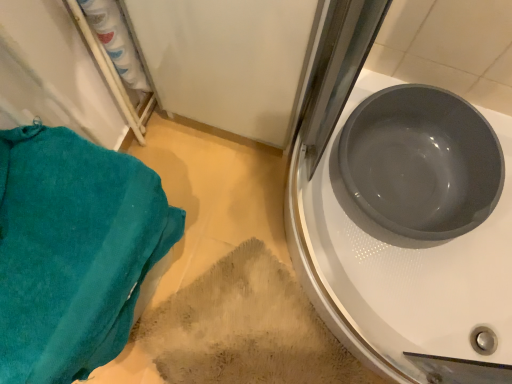
Where is `beige textured rug at lower center`? beige textured rug at lower center is located at coordinates (245, 328).

I want to click on matte gray basin at right, so click(421, 162).

Would you say teal terry cloth towel at lower left is inside or outside matte gray basin at upper right?

The correct answer is: outside.

From a real-world perspective, is teal terry cloth towel at lower left on matte gray basin at upper right?

Yes, from a real-world perspective, teal terry cloth towel at lower left is above matte gray basin at upper right.

Consider the image. What's the angular difference between teal terry cloth towel at lower left and matte gray basin at upper right's facing directions?

There is a 91-degree angle between the facing directions of teal terry cloth towel at lower left and matte gray basin at upper right.

Is teal terry cloth towel at lower left positioned with its back to matte gray basin at upper right?

That's not correct — teal terry cloth towel at lower left is not looking away from matte gray basin at upper right.

From a real-world perspective, between beige textured rug at lower center and matte gray basin at right, who is vertically higher?

matte gray basin at right is physically above.

The height and width of the screenshot is (384, 512). Find the location of `dirt below the matte gray basin at right (from the image's perspective)`. dirt below the matte gray basin at right (from the image's perspective) is located at coordinates tap(245, 328).

Can you confirm if beige textured rug at lower center is positioned to the left of matte gray basin at right?

Yes.

Which is behind, point (362, 378) or point (432, 90)?

The point (362, 378) is farther from the camera.

Based on their sizes in the image, would you say matte gray basin at upper right is bigger or smaller than teal terry cloth towel at lower left?

Considering their sizes, matte gray basin at upper right takes up more space than teal terry cloth towel at lower left.

You are a GUI agent. You are given a task and a screenshot of the screen. Output one action in this format:
    pyautogui.click(x=<x>, y=<y>)
    Task: Click on the sink that appears above the teal terry cloth towel at lower left (from the image's perspective)
    This screenshot has height=384, width=512.
    Given the screenshot: What is the action you would take?
    pyautogui.click(x=403, y=219)

Considering the positions of point (359, 233) and point (121, 350), is point (359, 233) closer or farther from the camera than point (121, 350)?

Point (359, 233) is positioned farther from the camera compared to point (121, 350).

Considering the sizes of matte gray basin at right and matte gray basin at upper right in the image, is matte gray basin at right taller or shorter than matte gray basin at upper right?

In the image, matte gray basin at right appears to be shorter than matte gray basin at upper right.

Based on their positions, is matte gray basin at right located to the left or right of matte gray basin at upper right?

matte gray basin at right is to the left of matte gray basin at upper right.

Which object is closer to the camera, matte gray basin at right or matte gray basin at upper right?

matte gray basin at upper right is in front.

Is matte gray basin at right aimed at matte gray basin at upper right?

Yes, matte gray basin at right is facing matte gray basin at upper right.

From the image's perspective, is teal terry cloth towel at lower left beneath matte gray basin at right?

Yes, from the image's perspective, teal terry cloth towel at lower left is beneath matte gray basin at right.

Which is in front, point (104, 199) or point (412, 91)?

Positioned in front is point (104, 199).

Is teal terry cloth towel at lower left smaller than matte gray basin at right?

Actually, teal terry cloth towel at lower left might be larger than matte gray basin at right.

Considering the positions of objects teal terry cloth towel at lower left and matte gray basin at right in the image provided, who is behind, teal terry cloth towel at lower left or matte gray basin at right?

matte gray basin at right is further away from the camera.

Measure the distance from beige textured rug at lower center to teal terry cloth towel at lower left.

17.34 inches.

Is beige textured rug at lower center touching teal terry cloth towel at lower left?

beige textured rug at lower center is not next to teal terry cloth towel at lower left, and they're not touching.

Is teal terry cloth towel at lower left inside beige textured rug at lower center?

No, teal terry cloth towel at lower left is not inside beige textured rug at lower center.

Considering the relative sizes of beige textured rug at lower center and teal terry cloth towel at lower left in the image provided, is beige textured rug at lower center shorter than teal terry cloth towel at lower left?

Correct, beige textured rug at lower center is not as tall as teal terry cloth towel at lower left.

From a real-world perspective, which is physically below, matte gray basin at upper right or matte gray basin at right?

From a 3D spatial view, matte gray basin at upper right is below.

Is matte gray basin at right located within matte gray basin at upper right?

Yes.

Does matte gray basin at upper right have a greater height compared to matte gray basin at right?

Yes, matte gray basin at upper right is taller than matte gray basin at right.

Locate an element on the screen. This screenshot has height=384, width=512. sink below the matte gray basin at right (from the image's perspective) is located at coordinates (403, 219).

Where is `sink behind the teal terry cloth towel at lower left`? sink behind the teal terry cloth towel at lower left is located at coordinates [x=403, y=219].

Locate an element on the screen. basin that is in front of the beige textured rug at lower center is located at coordinates (421, 162).

Estimate the real-world distances between objects in this image. Which object is further from matte gray basin at upper right, teal terry cloth towel at lower left or matte gray basin at right?

Based on the image, teal terry cloth towel at lower left appears to be further to matte gray basin at upper right.

From the image, which object appears to be nearer to teal terry cloth towel at lower left, matte gray basin at upper right or matte gray basin at right?

matte gray basin at upper right.

Considering their positions, is teal terry cloth towel at lower left positioned closer to beige textured rug at lower center than matte gray basin at upper right?

Based on the image, matte gray basin at upper right appears to be nearer to beige textured rug at lower center.

From the image, which object appears to be nearer to matte gray basin at right, matte gray basin at upper right or beige textured rug at lower center?

matte gray basin at upper right is positioned closer to the anchor matte gray basin at right.

When comparing their distances from matte gray basin at upper right, does beige textured rug at lower center or matte gray basin at right seem closer?

matte gray basin at right is positioned closer to the anchor matte gray basin at upper right.

Based on their spatial positions, is matte gray basin at right or teal terry cloth towel at lower left further from beige textured rug at lower center?

Based on the image, matte gray basin at right appears to be further to beige textured rug at lower center.

Based on their spatial positions, is beige textured rug at lower center or teal terry cloth towel at lower left further from matte gray basin at right?

Among the two, teal terry cloth towel at lower left is located further to matte gray basin at right.

From the image, which object appears to be nearer to teal terry cloth towel at lower left, beige textured rug at lower center or matte gray basin at right?

Among the two, beige textured rug at lower center is located nearer to teal terry cloth towel at lower left.

Where is `dirt between teal terry cloth towel at lower left and matte gray basin at upper right`? This screenshot has height=384, width=512. dirt between teal terry cloth towel at lower left and matte gray basin at upper right is located at coordinates (245, 328).

You are a GUI agent. You are given a task and a screenshot of the screen. Output one action in this format:
    pyautogui.click(x=<x>, y=<y>)
    Task: Click on the sink between matte gray basin at right and beige textured rug at lower center vertically
    The width and height of the screenshot is (512, 384).
    Given the screenshot: What is the action you would take?
    pyautogui.click(x=403, y=219)

Find the location of a particular element. This screenshot has height=384, width=512. dirt between teal terry cloth towel at lower left and matte gray basin at right is located at coordinates (245, 328).

Where is `basin between teal terry cloth towel at lower left and matte gray basin at upper right`? basin between teal terry cloth towel at lower left and matte gray basin at upper right is located at coordinates (421, 162).